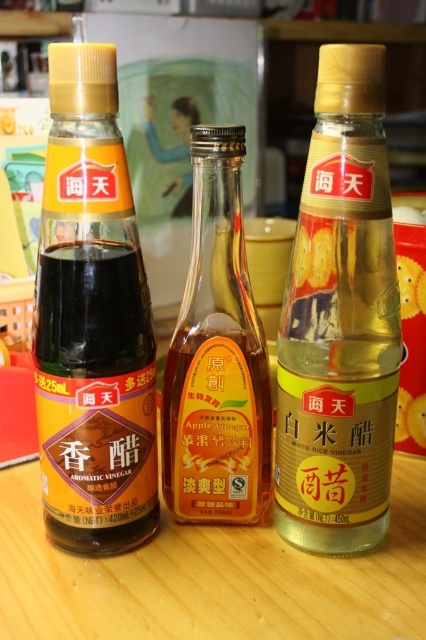
You have two bottles of vinegar on a wooden table. One is the matte black bottle at left and the other is the translucent glass bottle at center. Which one has a larger capacity?

The matte black bottle at left has a larger capacity than the translucent glass bottle at center.